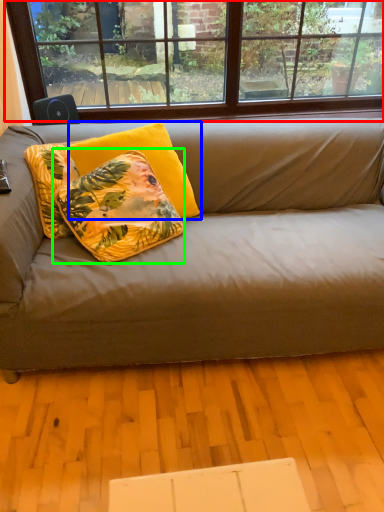
Question: Which object is the closest to the window (highlighted by a red box)? Choose among these: pillow (highlighted by a blue box) or pillow (highlighted by a green box).

Choices:
 (A) pillow
 (B) pillow

Answer: (B)